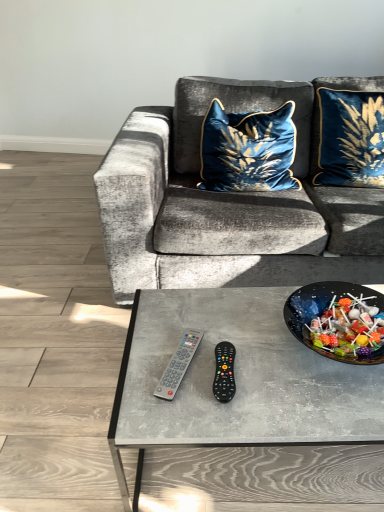
Question: Visually, is gray plastic remote at center positioned to the left or to the right of velvet blue pillow at upper right, marked as the 1th pillow in a right-to-left arrangement?

Choices:
 (A) right
 (B) left

Answer: (B)

Question: Considering the positions of gray plastic remote at center and velvet blue pillow at upper right, marked as the 1th pillow in a right-to-left arrangement, in the image, is gray plastic remote at center wider or thinner than velvet blue pillow at upper right, marked as the 1th pillow in a right-to-left arrangement,?

Choices:
 (A) thin
 (B) wide

Answer: (A)

Question: Based on their relative distances, which object is farther from the velvet blue pillow at upper right, marked as the 1th pillow in a right-to-left arrangement?

Choices:
 (A) shiny black bowl at center
 (B) gray plastic remote at center
 (C) velvet blue cushion at center, placed as the second pillow when sorted from right to left
 (D) black plastic remote at center

Answer: (D)

Question: Estimate the real-world distances between objects in this image. Which object is closer to the velvet blue cushion at center, which is counted as the 1th pillow, starting from the left?

Choices:
 (A) black plastic remote at center
 (B) shiny black bowl at center
 (C) velvet blue pillow at upper right, marked as the 1th pillow in a right-to-left arrangement
 (D) gray plastic remote at center

Answer: (C)